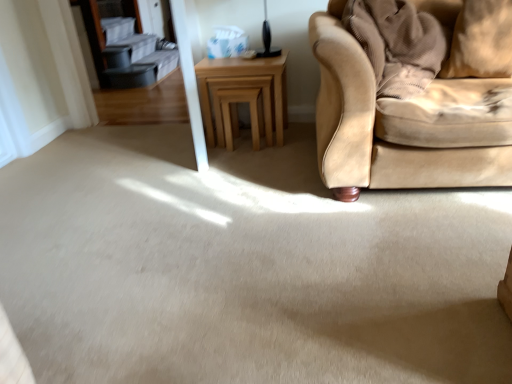
Question: Is light brown wooden table at center directly adjacent to beige fabric pillow at upper right?

Choices:
 (A) yes
 (B) no

Answer: (B)

Question: Is beige fabric pillow at upper right inside light brown wooden table at center?

Choices:
 (A) no
 (B) yes

Answer: (A)

Question: From the image's perspective, is light brown wooden table at center located above beige fabric pillow at upper right?

Choices:
 (A) yes
 (B) no

Answer: (B)

Question: From the image's perspective, is light brown wooden table at center beneath beige fabric pillow at upper right?

Choices:
 (A) yes
 (B) no

Answer: (A)

Question: Can we say light brown wooden table at center lies outside beige fabric pillow at upper right?

Choices:
 (A) no
 (B) yes

Answer: (B)

Question: Is light brown wooden table at center looking in the opposite direction of beige fabric pillow at upper right?

Choices:
 (A) yes
 (B) no

Answer: (B)

Question: Is light brown wooden stool at center directly adjacent to beige fabric pillow at upper right?

Choices:
 (A) no
 (B) yes

Answer: (A)

Question: Does light brown wooden stool at center have a lesser width compared to beige fabric pillow at upper right?

Choices:
 (A) no
 (B) yes

Answer: (A)

Question: Can you confirm if light brown wooden stool at center is bigger than beige fabric pillow at upper right?

Choices:
 (A) no
 (B) yes

Answer: (B)

Question: Can you confirm if light brown wooden stool at center is positioned to the left of beige fabric pillow at upper right?

Choices:
 (A) no
 (B) yes

Answer: (B)

Question: Is light brown wooden stool at center positioned far away from beige fabric pillow at upper right?

Choices:
 (A) yes
 (B) no

Answer: (A)

Question: Could you tell me if light brown wooden stool at center is turned towards beige fabric pillow at upper right?

Choices:
 (A) no
 (B) yes

Answer: (A)

Question: From a real-world perspective, is beige fabric pillow at upper right beneath light brown wooden stool at center?

Choices:
 (A) no
 (B) yes

Answer: (A)